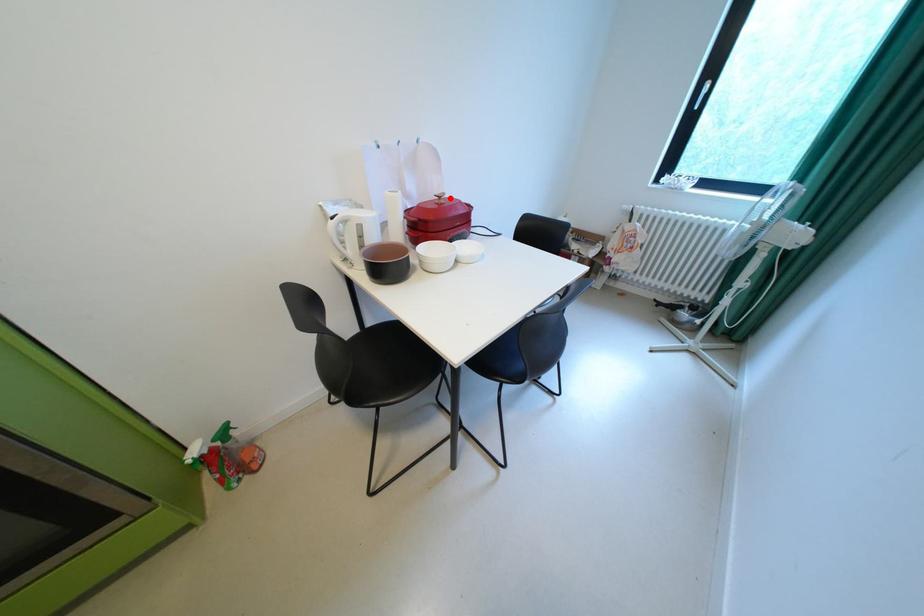
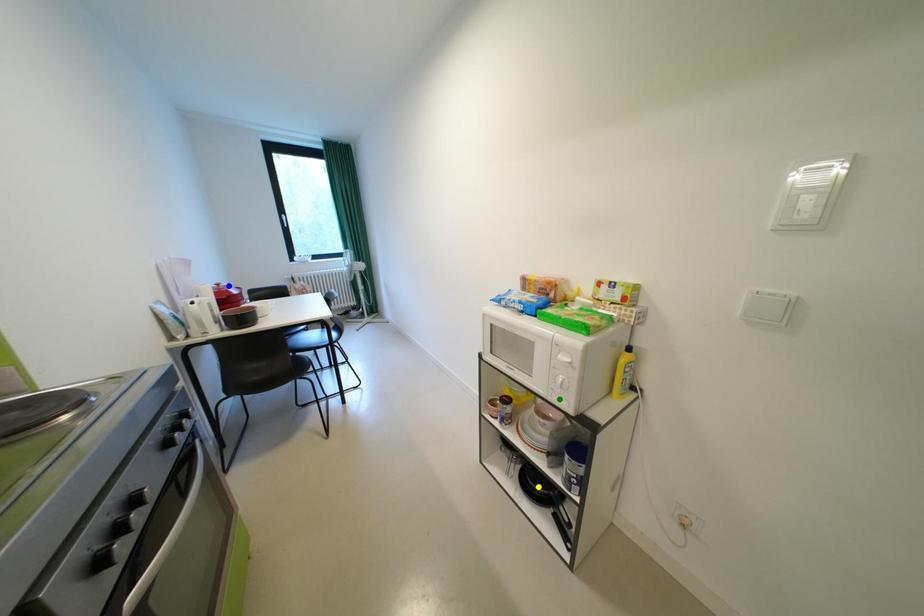
Question: I am providing you with two images of the same scene from different viewpoints. A red point is marked on the first image. You are given multiple points on the second image. Which point in image 2 is actually the same real-world point as the red point in image 1?

Choices:
 (A) blue point
 (B) yellow point
 (C) green point

Answer: (A)